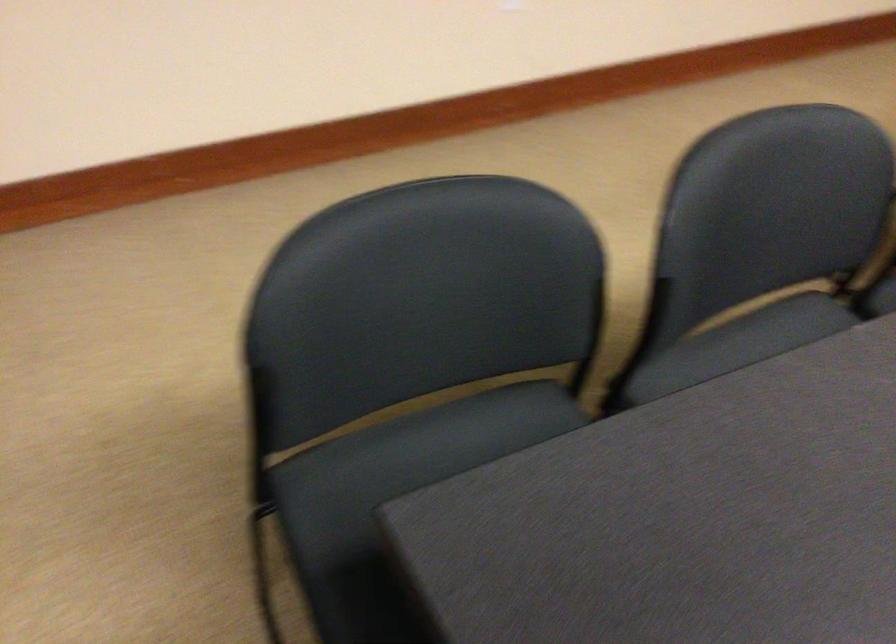
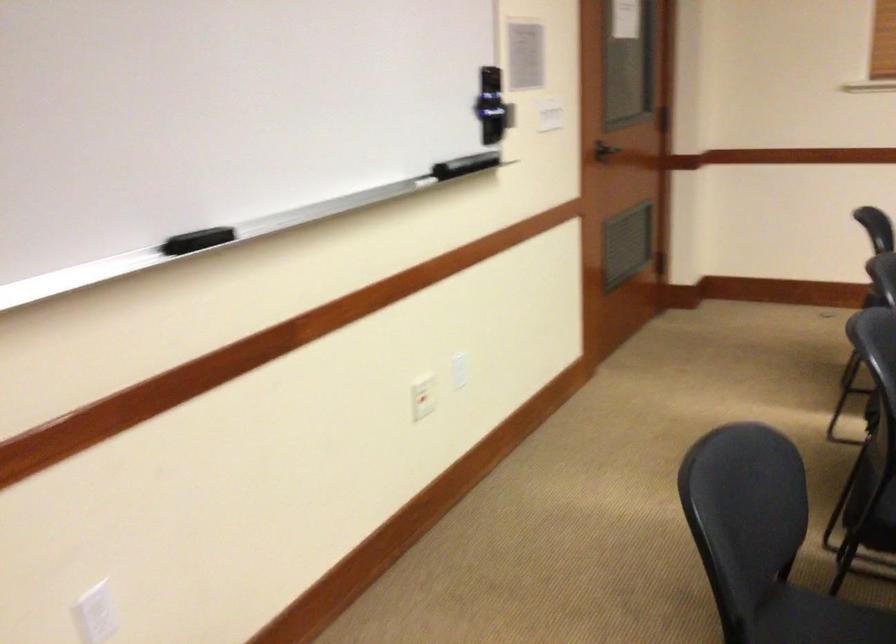
Based on the continuous images, in which direction is the camera rotating?

The camera rotated toward right-down.